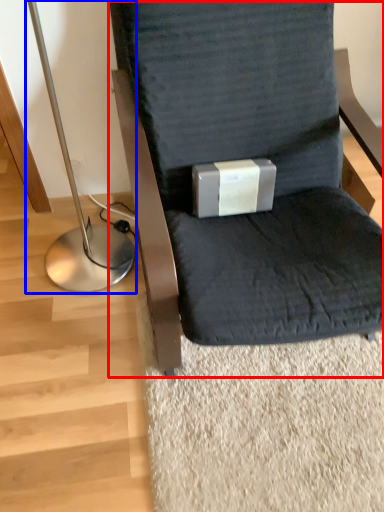
Question: Which object appears farthest to the camera in this image, chair (highlighted by a red box) or bedside lamp (highlighted by a blue box)?

Choices:
 (A) chair
 (B) bedside lamp

Answer: (B)